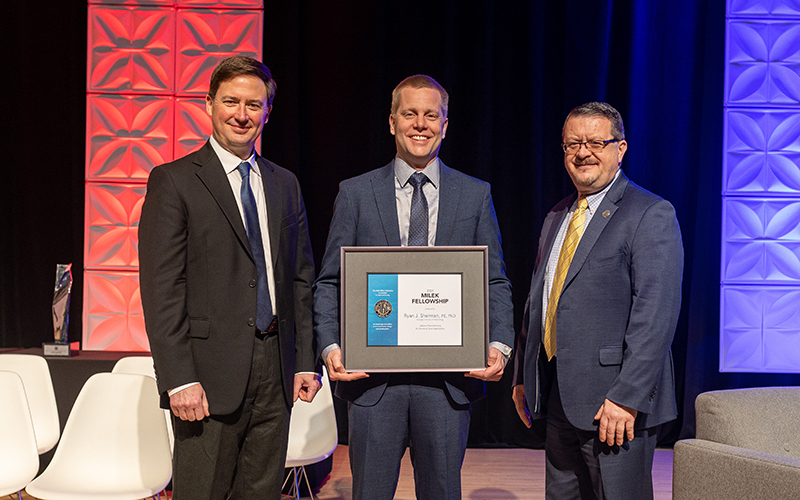
Locate an element on the screen. This screenshot has height=500, width=800. blue column is located at coordinates (789, 95), (781, 332).